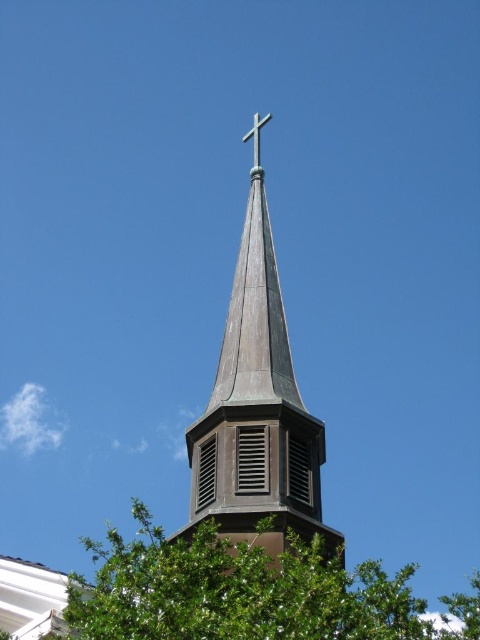
You are standing in a park and see the green leafy tree at center and the shiny copper steeple at center. Which object is closer to the ground?

The green leafy tree at center is closer to the ground because it is positioned under the shiny copper steeple at center.

You are standing in front of the church steeple and want to place a small birdhouse between the green leafy tree at center and the metallic cross at upper center. Based on their positions, which object should the birdhouse be closer to?

The green leafy tree at center is closer to the viewer than the metallic cross at upper center, so the birdhouse should be placed closer to the metallic cross at upper center to be between them.